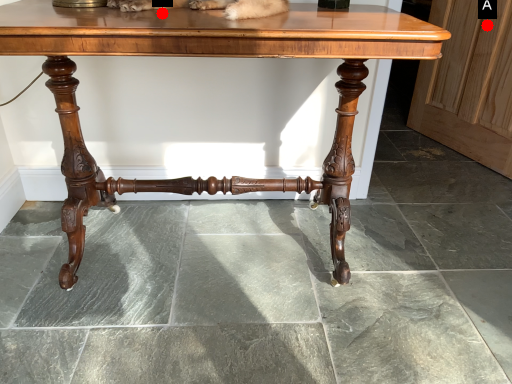
Question: Two points are circled on the image, labeled by A and B beside each circle. Which point is closer to the camera?

Choices:
 (A) A is closer
 (B) B is closer

Answer: (B)